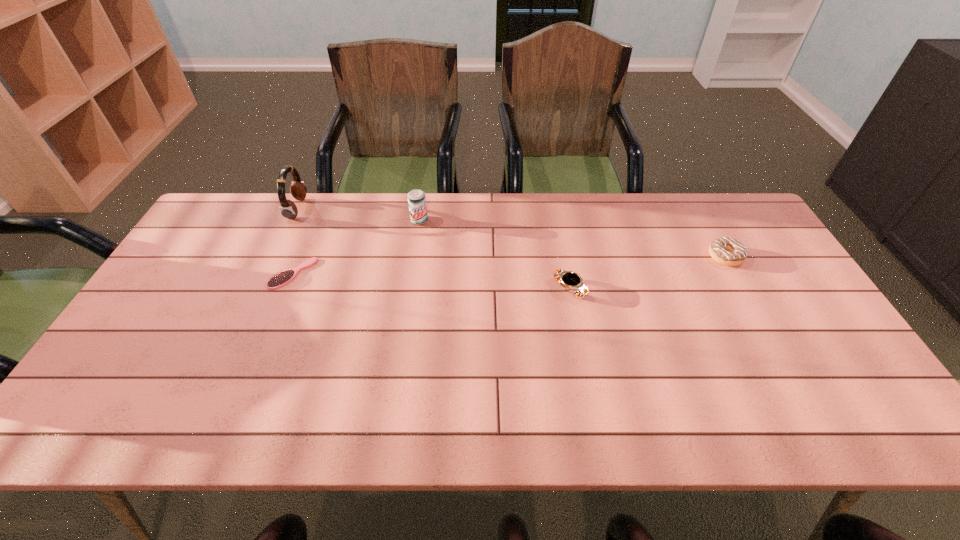
Where is `blank space that satisfies the following two spatial constraints: 1. on the front side of the beer can; 2. on the right side of the rightmost object`? The image size is (960, 540). blank space that satisfies the following two spatial constraints: 1. on the front side of the beer can; 2. on the right side of the rightmost object is located at coordinates [x=414, y=256].

Image resolution: width=960 pixels, height=540 pixels. Identify the location of free region that satisfies the following two spatial constraints: 1. on the ear cup of the headset; 2. on the right side of the hairbrush. (267, 274).

The image size is (960, 540). What are the coordinates of `vacant position in the image that satisfies the following two spatial constraints: 1. on the ear cup of the tallest object; 2. on the left side of the hairbrush` in the screenshot? It's located at (267, 274).

At what (x,y) coordinates should I click in order to perform the action: click on blank area in the image that satisfies the following two spatial constraints: 1. on the ear cup of the hairbrush; 2. on the left side of the headset. Please return your answer as a coordinate pair (x, y). The image size is (960, 540). Looking at the image, I should click on (267, 274).

Locate an element on the screen. blank space that satisfies the following two spatial constraints: 1. on the back side of the watch; 2. on the ear cup of the headset is located at coordinates (554, 209).

Where is `free point that satisfies the following two spatial constraints: 1. on the front side of the fourth shortest object; 2. on the right side of the second object from right to left`? This screenshot has width=960, height=540. free point that satisfies the following two spatial constraints: 1. on the front side of the fourth shortest object; 2. on the right side of the second object from right to left is located at coordinates (409, 289).

You are a GUI agent. You are given a task and a screenshot of the screen. Output one action in this format:
    pyautogui.click(x=<x>, y=<y>)
    Task: Click on the blank space that satisfies the following two spatial constraints: 1. on the ear cup of the fourth object from left to right; 2. on the right side of the headset
    
    Given the screenshot: What is the action you would take?
    pyautogui.click(x=259, y=289)

Identify the location of free location that satisfies the following two spatial constraints: 1. on the ear cup of the tallest object; 2. on the left side of the third object from left to right. Image resolution: width=960 pixels, height=540 pixels. (292, 220).

Where is `vacant region that satisfies the following two spatial constraints: 1. on the ear cup of the hairbrush; 2. on the right side of the tallest object`? This screenshot has width=960, height=540. vacant region that satisfies the following two spatial constraints: 1. on the ear cup of the hairbrush; 2. on the right side of the tallest object is located at coordinates (267, 274).

The width and height of the screenshot is (960, 540). In order to click on vacant area that satisfies the following two spatial constraints: 1. on the ear cup of the rightmost object; 2. on the right side of the headset in this screenshot , I will do `click(275, 256)`.